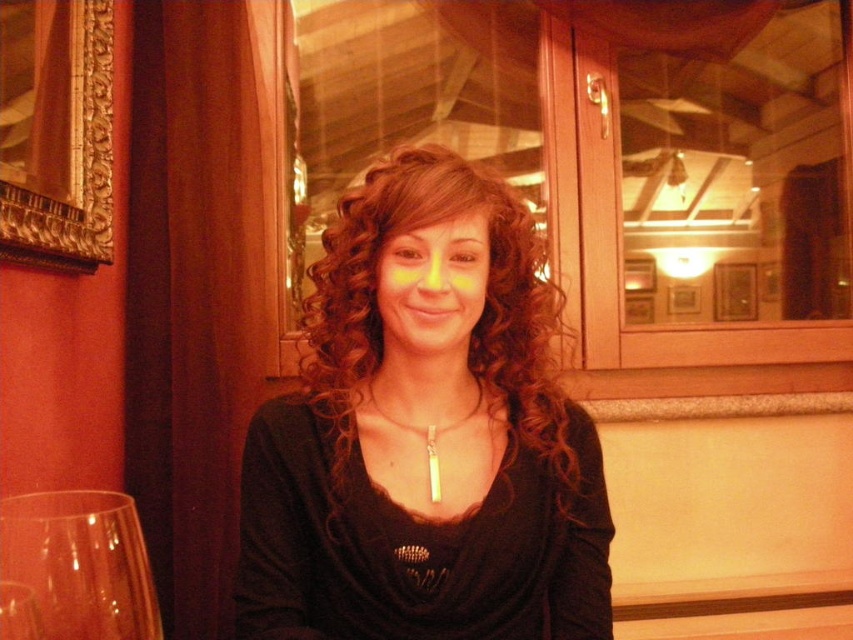
You are taking a photo of the scene and want to focus on both the point at point [297,566] and point [76,541]. Which point should you adjust your camera focus to prioritize to ensure both are in focus?

Since point [297,566] is further to the camera than point [76,541], you should prioritize focusing on point [76,541] because it is closer and adjusting focus for the closer point will likely keep the further point in focus as well.

You are a fashion designer observing the scene. You need to decide whether the matte black shirt at center can be seen from the transparent glass at lower left. Based on their sizes, can you determine if the shirt is large enough to be visible through the glass?

The matte black shirt at center is larger in size than transparent glass at lower left, so yes, the shirt is large enough to be visible through the glass.

You are a photographer setting up a shot of the scene described. You need to ensure that the matte black shirt at center and the transparent glass at lower left are at least 12 inches apart to avoid overlap in the frame. Based on the given information, will you need to adjust the camera position or composition?

The matte black shirt at center and transparent glass at lower left are 11.50 inches apart, which is less than the required 12 inches. Therefore, you will need to adjust the camera position or composition to increase the distance between them in the frame.